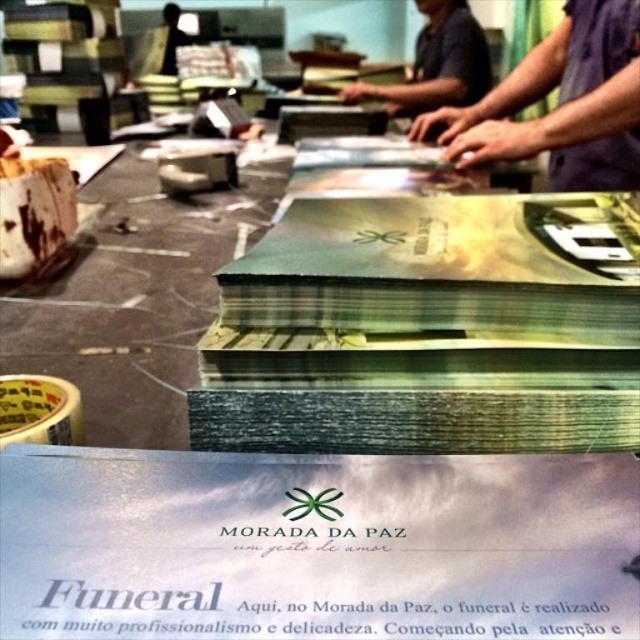
Question: Is purple sleeveless shirt at upper right thinner than black fabric at upper left?

Choices:
 (A) no
 (B) yes

Answer: (A)

Question: Which object is the closest to the purple sleeveless shirt at upper right?

Choices:
 (A) dark blue shirt at upper center
 (B) black fabric at upper left

Answer: (A)

Question: Can you confirm if purple sleeveless shirt at upper right is positioned to the left of black fabric at upper left?

Choices:
 (A) yes
 (B) no

Answer: (B)

Question: Which point is farther to the camera?

Choices:
 (A) dark blue shirt at upper center
 (B) black fabric at upper left

Answer: (B)

Question: Does purple sleeveless shirt at upper right have a lesser width compared to dark blue shirt at upper center?

Choices:
 (A) no
 (B) yes

Answer: (B)

Question: Which object is positioned closest to the black fabric at upper left?

Choices:
 (A) dark blue shirt at upper center
 (B) purple sleeveless shirt at upper right

Answer: (A)